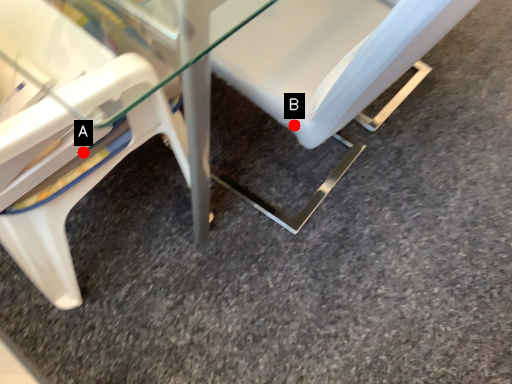
Question: Two points are circled on the image, labeled by A and B beside each circle. Which point is closer to the camera?

Choices:
 (A) A is closer
 (B) B is closer

Answer: (A)